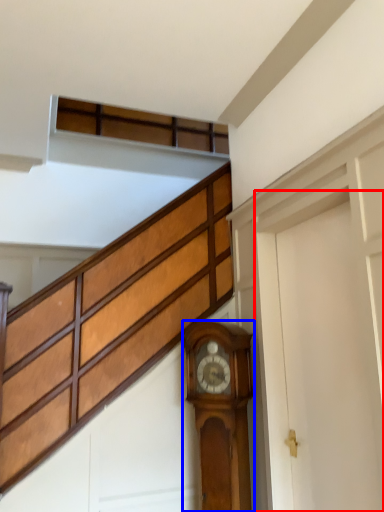
Question: Which of the following is the closest to the observer, garage door (highlighted by a red box) or wall clock (highlighted by a blue box)?

Choices:
 (A) garage door
 (B) wall clock

Answer: (A)